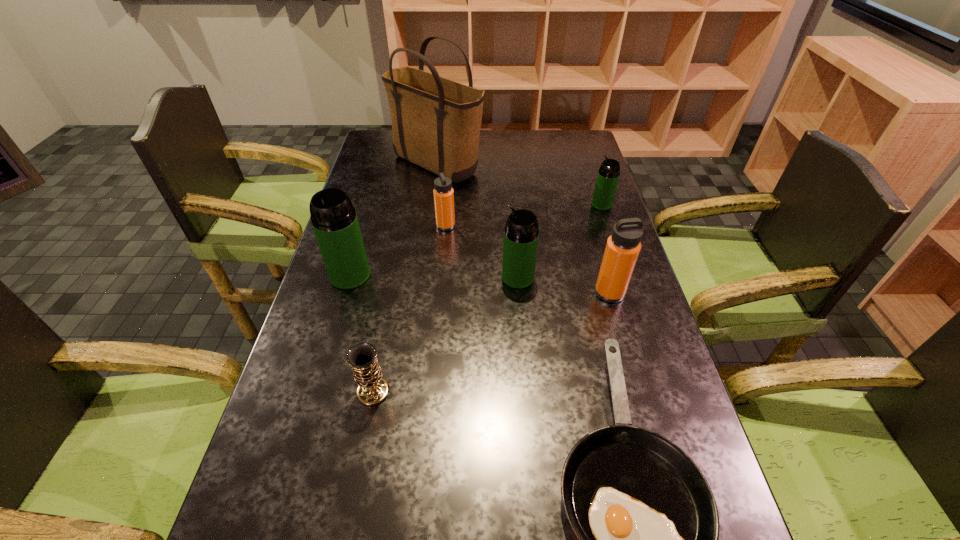
The height and width of the screenshot is (540, 960). What are the coordinates of `free space at the right edge` in the screenshot? It's located at [x=559, y=197].

At what (x,y) coordinates should I click in order to perform the action: click on vacant space at the far left corner. Please return your answer as a coordinate pair (x, y). This screenshot has height=540, width=960. Looking at the image, I should click on (389, 160).

Find the location of a particular element. This screenshot has height=540, width=960. free area in between the farthest thermos bottle and the second tallest object is located at coordinates (476, 240).

Where is `free space between the tallest object and the third thermos bottle from right to left`? free space between the tallest object and the third thermos bottle from right to left is located at coordinates (478, 221).

You are a GUI agent. You are given a task and a screenshot of the screen. Output one action in this format:
    pyautogui.click(x=<x>, y=<y>)
    Task: Click on the free space between the leftmost green thermos bottle and the left orange thermos bottle
    This screenshot has height=540, width=960.
    Given the screenshot: What is the action you would take?
    pyautogui.click(x=398, y=251)

Find the location of `vacant area between the tallest object and the chalice`. vacant area between the tallest object and the chalice is located at coordinates (405, 279).

Locate an element on the screen. The width and height of the screenshot is (960, 540). free space between the rightmost green thermos bottle and the second shortest object is located at coordinates (488, 298).

Locate an element on the screen. free space between the third thermos bottle from left to right and the biggest green thermos bottle is located at coordinates (434, 276).

Find the location of a particular element. The height and width of the screenshot is (540, 960). free space between the leftmost green thermos bottle and the second farthest object is located at coordinates (476, 240).

Identify the location of object that is the seventh closest to the bigger orange thermos bottle. (334, 220).